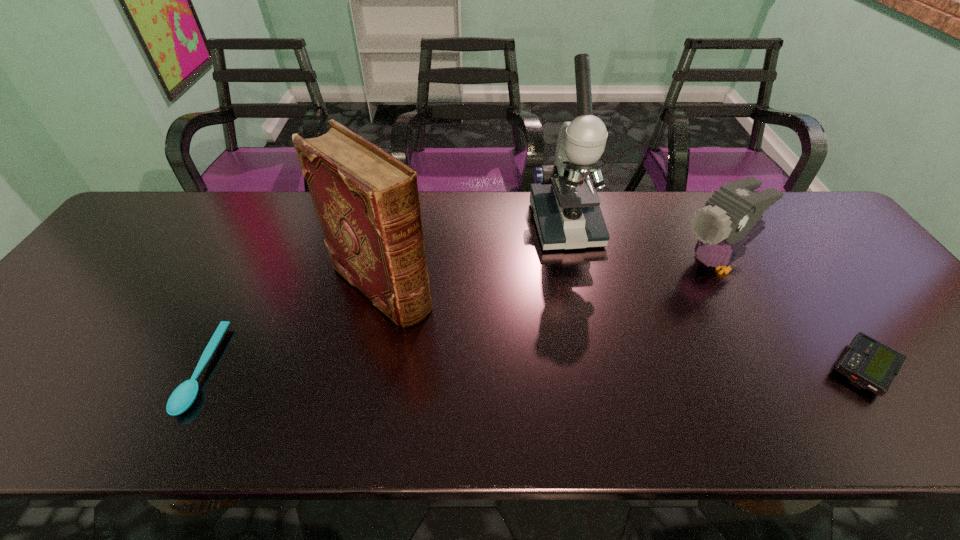
The height and width of the screenshot is (540, 960). Identify the location of free space between the rightmost object and the shortest object. (533, 369).

Image resolution: width=960 pixels, height=540 pixels. I want to click on the second closest object to the third tallest object, so click(x=867, y=363).

You are a GUI agent. You are given a task and a screenshot of the screen. Output one action in this format:
    pyautogui.click(x=<x>, y=<y>)
    Task: Click on the object that stands as the second closest to the bird
    The height and width of the screenshot is (540, 960).
    Given the screenshot: What is the action you would take?
    pyautogui.click(x=867, y=363)

I want to click on blank space that satisfies the following two spatial constraints: 1. on the front side of the bird; 2. on the left side of the rightmost object, so click(770, 369).

Where is `blank area in the image that satisfies the following two spatial constraints: 1. on the back side of the fourth shortest object; 2. on the right side of the second object from right to left`? This screenshot has height=540, width=960. blank area in the image that satisfies the following two spatial constraints: 1. on the back side of the fourth shortest object; 2. on the right side of the second object from right to left is located at coordinates (386, 263).

You are a GUI agent. You are given a task and a screenshot of the screen. Output one action in this format:
    pyautogui.click(x=<x>, y=<y>)
    Task: Click on the free space that satisfies the following two spatial constraints: 1. on the front side of the rightmost object; 2. on the right side of the third object from left to right
    
    Given the screenshot: What is the action you would take?
    [596, 369]